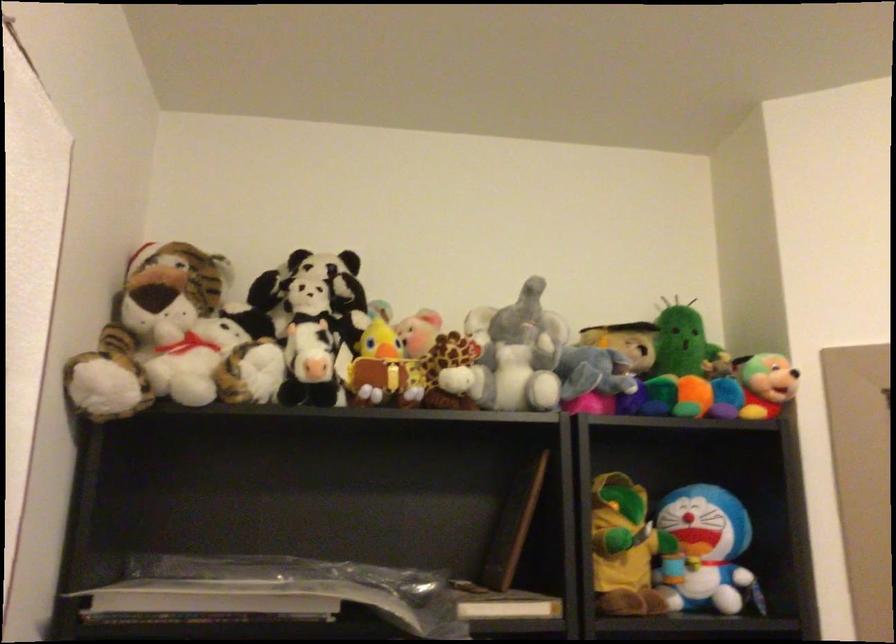
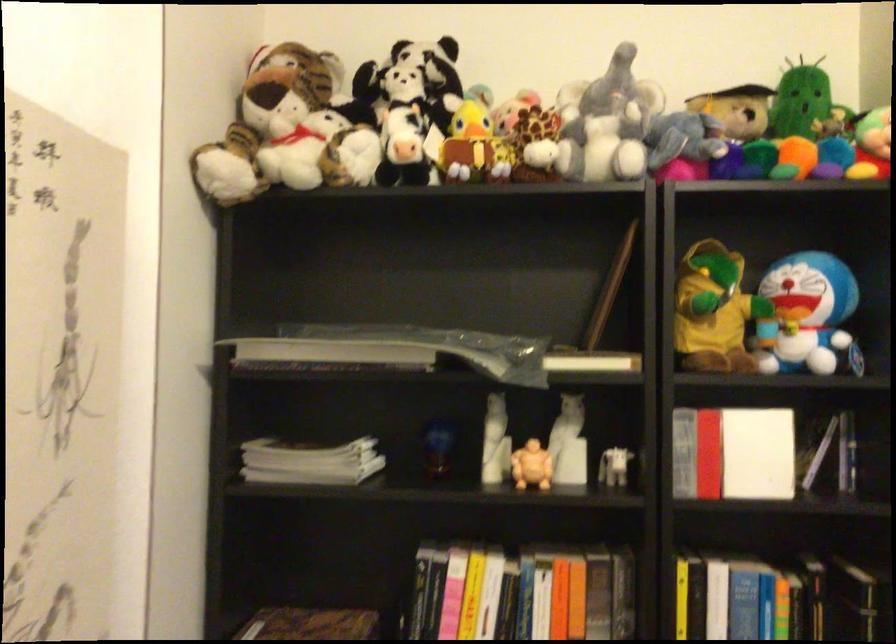
In the second image, find the point that corresponds to pixel 519 352 in the first image.

(607, 122)